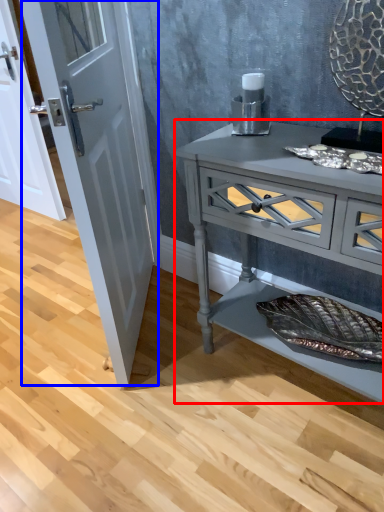
Question: Which object is further to the camera taking this photo, chest of drawers (highlighted by a red box) or door (highlighted by a blue box)?

Choices:
 (A) chest of drawers
 (B) door

Answer: (B)